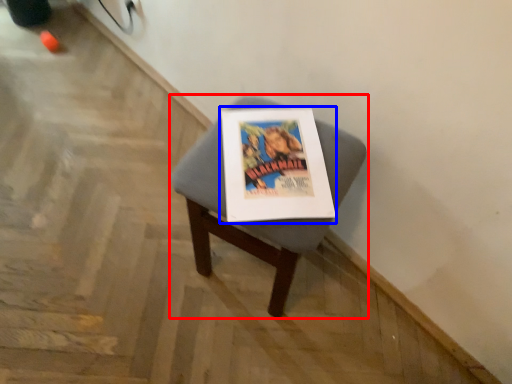
Question: Which object appears closest to the camera in this image, furniture (highlighted by a red box) or magazine (highlighted by a blue box)?

Choices:
 (A) furniture
 (B) magazine

Answer: (A)